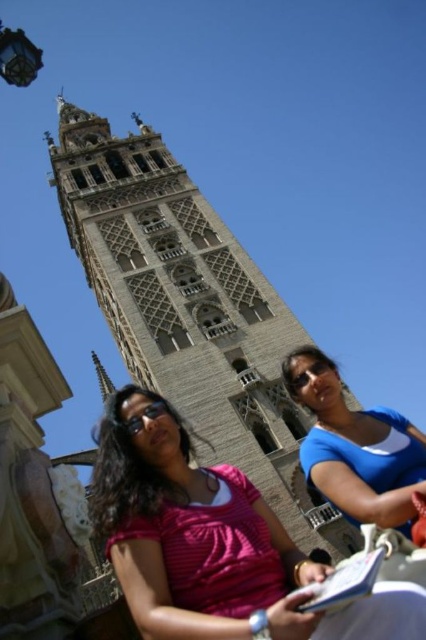
You are a tourist holding the black matte goggles at lower center and want to take a photo of the stone tower at center. Can you see the entire tower in your viewfinder without moving your position?

The stone tower at center is located above the black matte goggles at lower center, so you can see the entire tower in your viewfinder without moving your position.

You are standing in the square facing the stone tower at center. A friend asks you to describe the position of the tower relative to your current viewpoint. How would you describe its location?

The stone tower at center is located at point coordinates approximately 0.481 on the x axis and 0.444 on the y axis relative to your viewpoint.